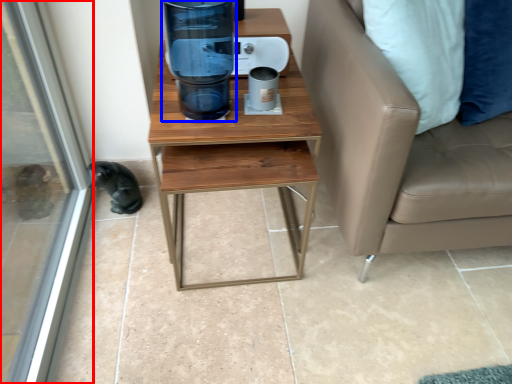
Question: Among these objects, which one is nearest to the camera, screen door (highlighted by a red box) or water cooler (highlighted by a blue box)?

Choices:
 (A) screen door
 (B) water cooler

Answer: (A)